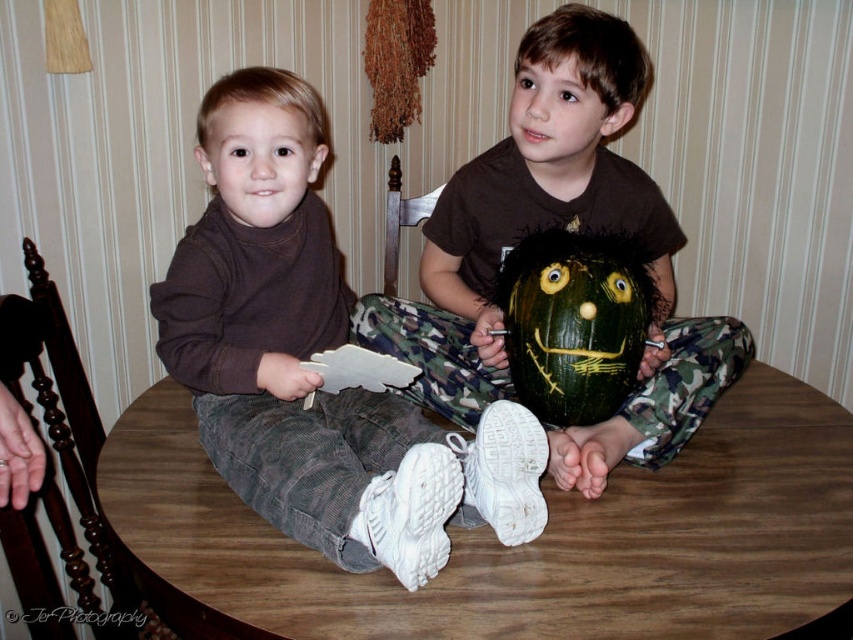
You are standing at the viewpoint of the image and want to reach the carved pumpkin first. Which point should you move towards, point [601,522] or point [531,104]?

You should move towards point [601,522] because it is in front of point [531,104], making it closer to your current position.

You are a parent observing your children at a wooden table. You see the brown cotton sweater at left and the green matte pumpkin at center. Which item is closer to the edge of the table?

The brown cotton sweater at left is positioned under the green matte pumpkin at center, so the sweater is closer to the edge of the table since it is underneath the pumpkin.